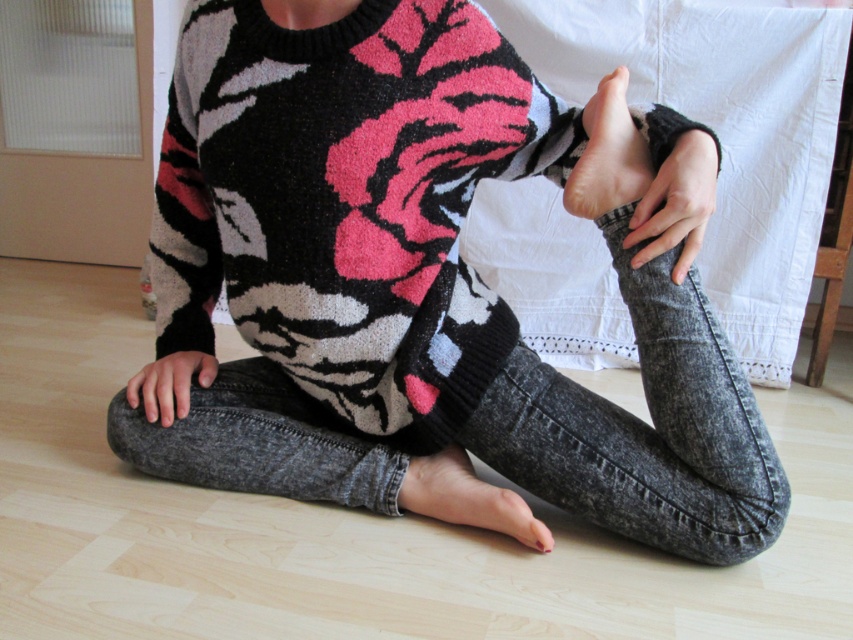
Question: Which of the following is the closest to the observer?

Choices:
 (A) (351, 403)
 (B) (456, 464)
 (C) (183, 369)
 (D) (601, 154)

Answer: (D)

Question: Can you confirm if knit sweater at center is positioned to the left of smooth skin hand at center?

Choices:
 (A) yes
 (B) no

Answer: (A)

Question: Can you confirm if knit sweater at center is smaller than smooth skin hand at center?

Choices:
 (A) no
 (B) yes

Answer: (A)

Question: Among these objects, which one is nearest to the camera?

Choices:
 (A) gray matte hand at lower left
 (B) pink matte foot at center
 (C) knit sweater at center

Answer: (B)

Question: Which is nearer to the knit sweater at center?

Choices:
 (A) smooth skin hand at center
 (B) pink matte foot at center
 (C) gray matte hand at lower left
 (D) smooth skin foot at lower center

Answer: (D)

Question: Is the position of smooth skin hand at center less distant than that of pink matte foot at center?

Choices:
 (A) no
 (B) yes

Answer: (B)